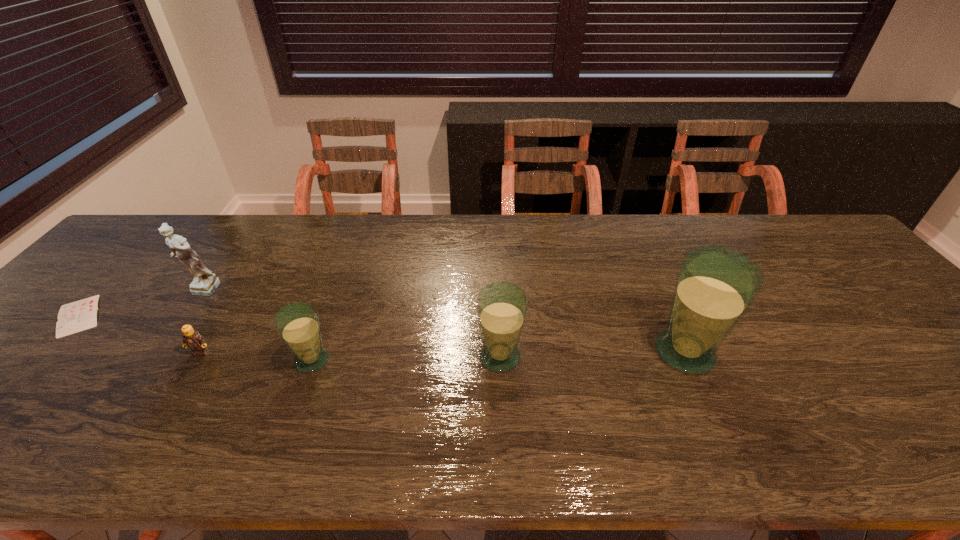
At what (x,y) coordinates should I click in order to perform the action: click on vacant space at the near edge. Please return your answer as a coordinate pair (x, y). The image size is (960, 540). Looking at the image, I should click on (505, 386).

Locate an element on the screen. Image resolution: width=960 pixels, height=540 pixels. free region at the left edge is located at coordinates 17,372.

You are a GUI agent. You are given a task and a screenshot of the screen. Output one action in this format:
    pyautogui.click(x=<x>, y=<y>)
    Task: Click on the vacant region at the right edge of the desktop
    This screenshot has width=960, height=540.
    Given the screenshot: What is the action you would take?
    pyautogui.click(x=842, y=260)

Where is `free space between the tallest glass and the Lego`? free space between the tallest glass and the Lego is located at coordinates (443, 353).

Identify the location of vacant region between the tallest glass and the Lego. (443, 353).

Where is `free space between the diary and the rightmost object`? This screenshot has height=540, width=960. free space between the diary and the rightmost object is located at coordinates (382, 334).

You are a GUI agent. You are given a task and a screenshot of the screen. Output one action in this format:
    pyautogui.click(x=<x>, y=<y>)
    Task: Click on the vacant region between the rightmost glass and the fifth object from left to right
    
    Given the screenshot: What is the action you would take?
    pyautogui.click(x=592, y=355)

This screenshot has width=960, height=540. I want to click on unoccupied position between the fourth tallest object and the fifth shortest object, so click(257, 326).

Image resolution: width=960 pixels, height=540 pixels. Identify the location of vacant region between the rightmost glass and the second shortest object. (443, 353).

Image resolution: width=960 pixels, height=540 pixels. Identify the location of vacant area between the fourth tallest object and the second shortest object. (256, 356).